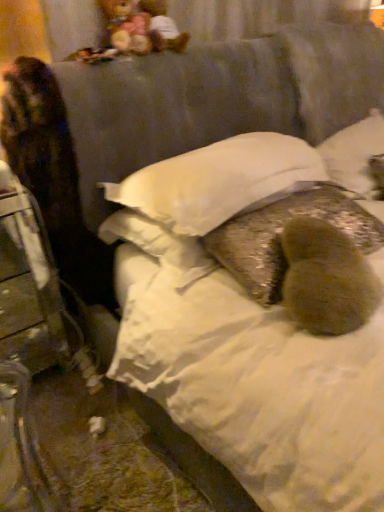
Question: Considering the relative sizes of white soft pillow at center, which is the third pillow in right-to-left order, and fuzzy brown pillow at center in the image provided, is white soft pillow at center, which is the third pillow in right-to-left order, taller than fuzzy brown pillow at center?

Choices:
 (A) yes
 (B) no

Answer: (B)

Question: Considering the relative positions of white soft pillow at center, marked as the first pillow in a left-to-right arrangement, and fuzzy brown pillow at center in the image provided, is white soft pillow at center, marked as the first pillow in a left-to-right arrangement, to the right of fuzzy brown pillow at center from the viewer's perspective?

Choices:
 (A) no
 (B) yes

Answer: (A)

Question: Can you confirm if white soft pillow at center, which is the third pillow in right-to-left order, is thinner than fuzzy brown pillow at center?

Choices:
 (A) yes
 (B) no

Answer: (B)

Question: From the image's perspective, is white soft pillow at center, marked as the first pillow in a left-to-right arrangement, located beneath fuzzy brown pillow at center?

Choices:
 (A) yes
 (B) no

Answer: (B)

Question: Is white soft pillow at center, marked as the first pillow in a left-to-right arrangement, behind fuzzy brown pillow at center?

Choices:
 (A) yes
 (B) no

Answer: (A)

Question: Is white soft pillow at center, which is the third pillow in right-to-left order, looking in the opposite direction of fuzzy brown pillow at center?

Choices:
 (A) no
 (B) yes

Answer: (A)

Question: Is fuzzy brown pillow at center, marked as the 2th pillow in a right-to-left arrangement, positioned beyond the bounds of matte plastic figurine at upper center, the first figurine in the right-to-left sequence?

Choices:
 (A) no
 (B) yes

Answer: (B)

Question: Does fuzzy brown pillow at center, which is the second pillow from left to right, have a lesser width compared to matte plastic figurine at upper center, positioned as the 2th figurine in left-to-right order?

Choices:
 (A) no
 (B) yes

Answer: (A)

Question: Does fuzzy brown pillow at center, which is the second pillow from left to right, appear on the right side of matte plastic figurine at upper center, the first figurine in the right-to-left sequence?

Choices:
 (A) yes
 (B) no

Answer: (A)

Question: Is fuzzy brown pillow at center, marked as the 2th pillow in a right-to-left arrangement, in contact with matte plastic figurine at upper center, positioned as the 2th figurine in left-to-right order?

Choices:
 (A) no
 (B) yes

Answer: (A)

Question: Does fuzzy brown pillow at center, marked as the 2th pillow in a right-to-left arrangement, lie behind matte plastic figurine at upper center, the first figurine in the right-to-left sequence?

Choices:
 (A) yes
 (B) no

Answer: (B)

Question: From the image's perspective, does fuzzy brown pillow at center, marked as the 2th pillow in a right-to-left arrangement, appear higher than matte plastic figurine at upper center, the first figurine in the right-to-left sequence?

Choices:
 (A) no
 (B) yes

Answer: (A)

Question: From a real-world perspective, is fuzzy brown pillow at center positioned under multicolored plush at upper left, placed as the 1th figurine when sorted from left to right, based on gravity?

Choices:
 (A) no
 (B) yes

Answer: (B)